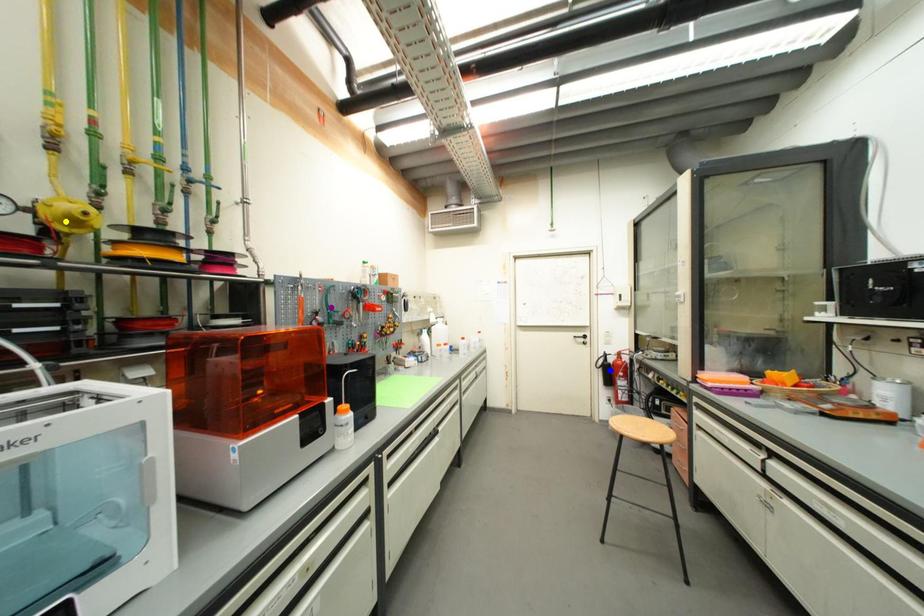
Order these from nearest to farthest:
- purple point
- blue point
- yellow point

yellow point → purple point → blue point